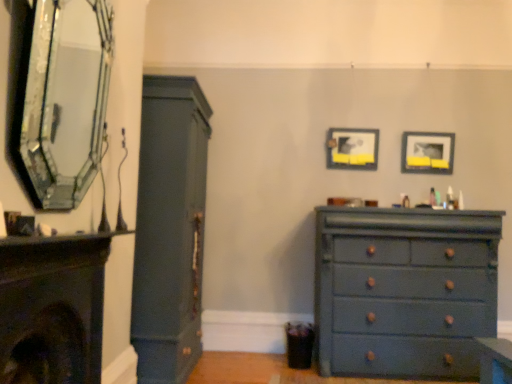
Question: Does matte dark blue fireplace at left, which appears as the 1th fireplace when ordered from the bottom, turn towards matte black fireplace at left, which is the 1th fireplace in top-to-bottom order?

Choices:
 (A) no
 (B) yes

Answer: (A)

Question: Does matte dark blue fireplace at left, acting as the 2th fireplace starting from the top, have a greater width compared to matte black fireplace at left, which is the 1th fireplace in top-to-bottom order?

Choices:
 (A) no
 (B) yes

Answer: (B)

Question: From a real-world perspective, is matte dark blue fireplace at left, which appears as the 1th fireplace when ordered from the bottom, physically below matte black fireplace at left, which is the 1th fireplace in top-to-bottom order?

Choices:
 (A) yes
 (B) no

Answer: (A)

Question: Considering the relative sizes of matte dark blue fireplace at left, which appears as the 1th fireplace when ordered from the bottom, and matte black fireplace at left, the second fireplace in the bottom-to-top sequence, in the image provided, is matte dark blue fireplace at left, which appears as the 1th fireplace when ordered from the bottom, bigger than matte black fireplace at left, the second fireplace in the bottom-to-top sequence,?

Choices:
 (A) no
 (B) yes

Answer: (B)

Question: From the image's perspective, is matte dark blue fireplace at left, which appears as the 1th fireplace when ordered from the bottom, over matte black fireplace at left, the second fireplace in the bottom-to-top sequence?

Choices:
 (A) no
 (B) yes

Answer: (A)

Question: Is matte dark green cabinet at left taller or shorter than matte blue dresser at lower right?

Choices:
 (A) tall
 (B) short

Answer: (A)

Question: Considering the positions of matte dark green cabinet at left and matte blue dresser at lower right in the image, is matte dark green cabinet at left bigger or smaller than matte blue dresser at lower right?

Choices:
 (A) small
 (B) big

Answer: (B)

Question: Considering the positions of matte dark green cabinet at left and matte blue dresser at lower right in the image, is matte dark green cabinet at left wider or thinner than matte blue dresser at lower right?

Choices:
 (A) thin
 (B) wide

Answer: (B)

Question: Does point (195, 327) appear closer or farther from the camera than point (429, 369)?

Choices:
 (A) farther
 (B) closer

Answer: (A)

Question: Visually, is matte black fireplace at left, which is the 1th fireplace in top-to-bottom order, positioned to the left or to the right of matte black picture frame at upper right, the 1th picture frame when ordered from right to left?

Choices:
 (A) left
 (B) right

Answer: (A)

Question: Is point (138, 51) closer or farther from the camera than point (435, 155)?

Choices:
 (A) farther
 (B) closer

Answer: (B)

Question: From the image's perspective, relative to matte black picture frame at upper right, the 2th picture frame positioned from the left, is matte black fireplace at left, the second fireplace in the bottom-to-top sequence, above or below?

Choices:
 (A) above
 (B) below

Answer: (A)

Question: Do you think matte black fireplace at left, which is the 1th fireplace in top-to-bottom order, is within matte black picture frame at upper right, the 2th picture frame positioned from the left, or outside of it?

Choices:
 (A) outside
 (B) inside

Answer: (A)

Question: Does point (167, 306) appear closer or farther from the camera than point (47, 374)?

Choices:
 (A) farther
 (B) closer

Answer: (A)

Question: Relative to matte dark blue fireplace at left, which appears as the 1th fireplace when ordered from the bottom, is matte dark green cabinet at left in front or behind?

Choices:
 (A) behind
 (B) front

Answer: (A)